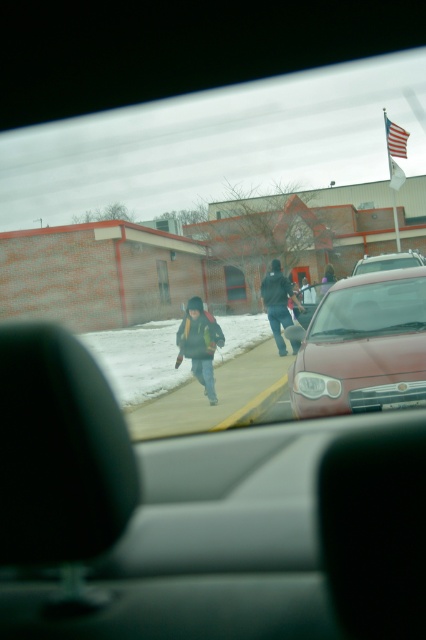
Question: In this image, where is smooth concrete sidewalk at center located relative to dark gray hoodie at center?

Choices:
 (A) below
 (B) above

Answer: (A)

Question: Can you confirm if clear glass windshield at center is positioned above metallic silver sedan at center?

Choices:
 (A) yes
 (B) no

Answer: (B)

Question: Does matte red car at center appear over dark gray hoodie at center?

Choices:
 (A) yes
 (B) no

Answer: (B)

Question: Which object is the farthest from the metallic silver sedan at center?

Choices:
 (A) green fuzzy jacket at center
 (B) smooth concrete sidewalk at center

Answer: (A)

Question: Which object appears farthest from the camera in this image?

Choices:
 (A) green fuzzy jacket at center
 (B) matte red car at center
 (C) dark blue jacket at center
 (D) smooth concrete sidewalk at center

Answer: (C)

Question: Which object is farther from the camera taking this photo?

Choices:
 (A) metallic silver sedan at center
 (B) green fuzzy jacket at center
 (C) smooth concrete sidewalk at center
 (D) clear glass windshield at center

Answer: (A)